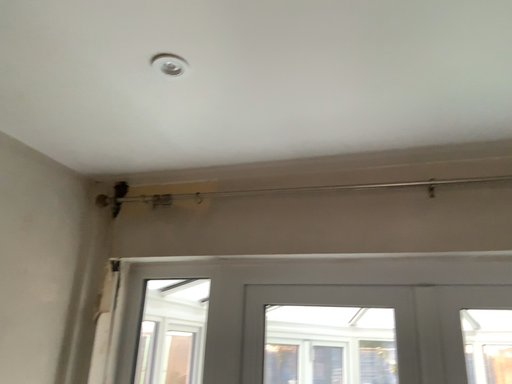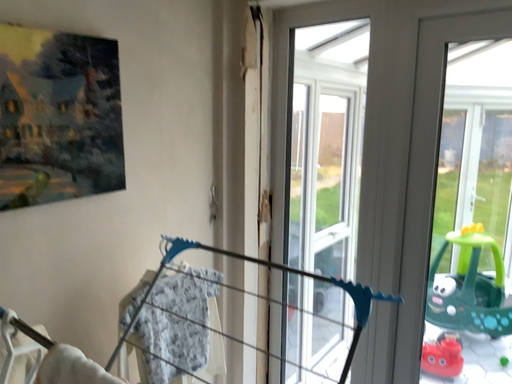
Question: How did the camera likely rotate when shooting the video?

Choices:
 (A) rotated upward
 (B) rotated downward

Answer: (B)